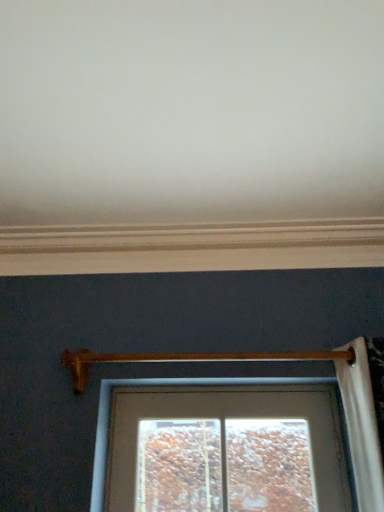
Question: Relative to wooden at center, is white painted wood at upper center in front or behind?

Choices:
 (A) behind
 (B) front

Answer: (A)

Question: Considering the positions of point (264, 267) and point (86, 362), is point (264, 267) closer or farther from the camera than point (86, 362)?

Choices:
 (A) farther
 (B) closer

Answer: (A)

Question: Looking at their shapes, would you say white painted wood at upper center is wider or thinner than wooden at center?

Choices:
 (A) thin
 (B) wide

Answer: (B)

Question: Is wooden at center to the left or to the right of white painted wood at upper center in the image?

Choices:
 (A) left
 (B) right

Answer: (B)

Question: Is wooden at center situated inside white painted wood at upper center or outside?

Choices:
 (A) outside
 (B) inside

Answer: (A)

Question: Is wooden at center bigger or smaller than white painted wood at upper center?

Choices:
 (A) small
 (B) big

Answer: (A)

Question: From a real-world perspective, relative to white painted wood at upper center, is wooden at center vertically above or below?

Choices:
 (A) above
 (B) below

Answer: (B)